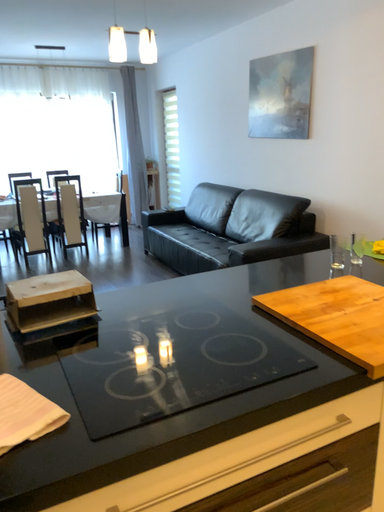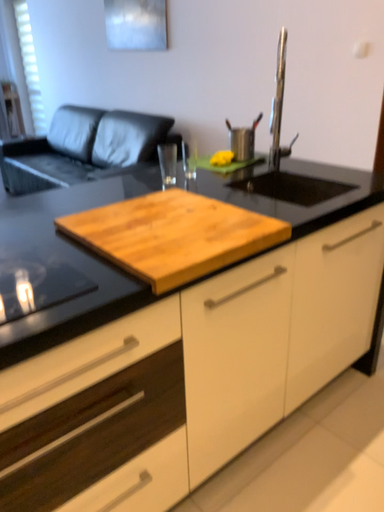
Question: Which way did the camera rotate in the video?

Choices:
 (A) rotated upward
 (B) rotated downward

Answer: (B)